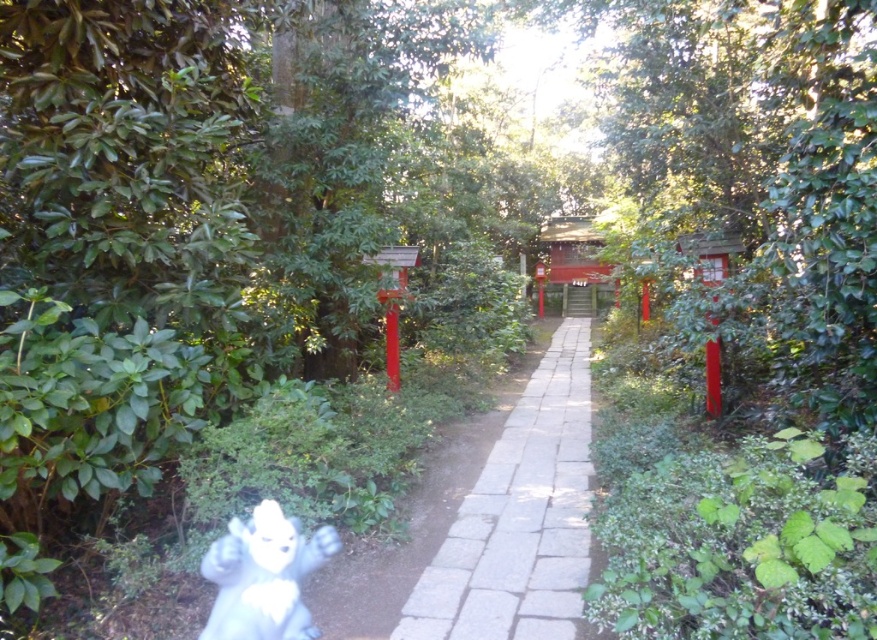
Question: Is white stone path at center further to camera compared to white plush toy at lower left?

Choices:
 (A) no
 (B) yes

Answer: (B)

Question: Which object appears closest to the camera in this image?

Choices:
 (A) white stone path at center
 (B) white plush toy at lower left

Answer: (B)

Question: Can you confirm if white stone path at center is smaller than white plush toy at lower left?

Choices:
 (A) yes
 (B) no

Answer: (B)

Question: Can you confirm if white stone path at center is positioned to the right of white plush toy at lower left?

Choices:
 (A) no
 (B) yes

Answer: (B)

Question: Which point is closer to the camera?

Choices:
 (A) (269, 554)
 (B) (589, 372)

Answer: (A)